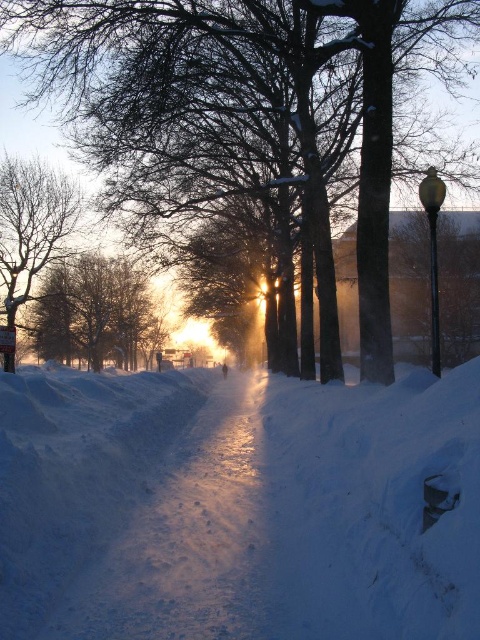
You are a delivery person needing to walk along the path. The white powdery snow at center and the snowy bare tree at left are in your way. Which one is closer to your right side as you face the direction of the path?

The white powdery snow at center is to the right of the snowy bare tree at left, so as you face the path, the white powdery snow at center is closer to your right side.